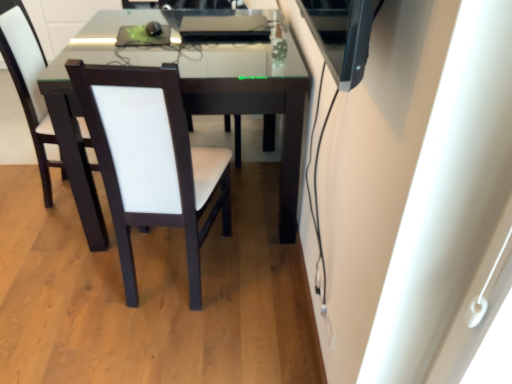
Locate an element on the screen. This screenshot has width=512, height=384. vacant area in front of white leather chair at center, the 1th chair from the right is located at coordinates (159, 308).